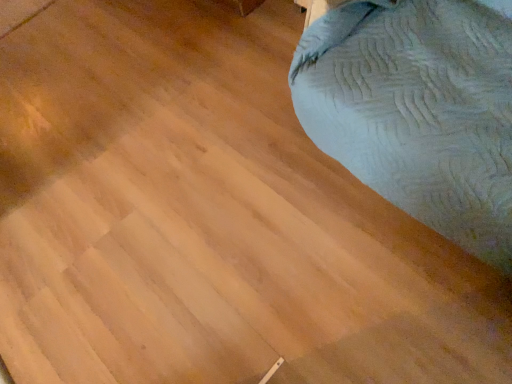
The height and width of the screenshot is (384, 512). I want to click on vacant space that is to the left of light blue quilted fabric at upper right, so click(223, 210).